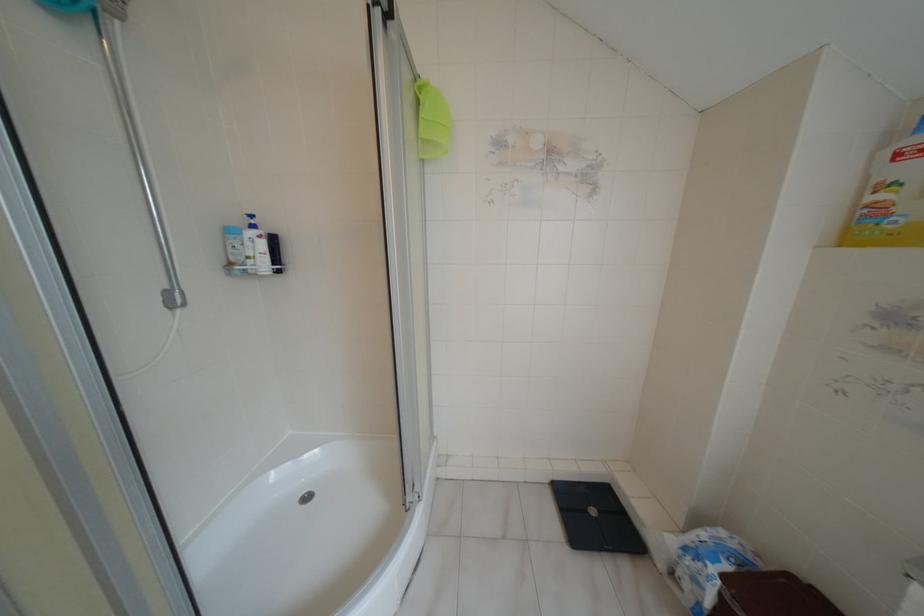
Describe the element at coordinates (249, 238) in the screenshot. I see `the blue bottle pump` at that location.